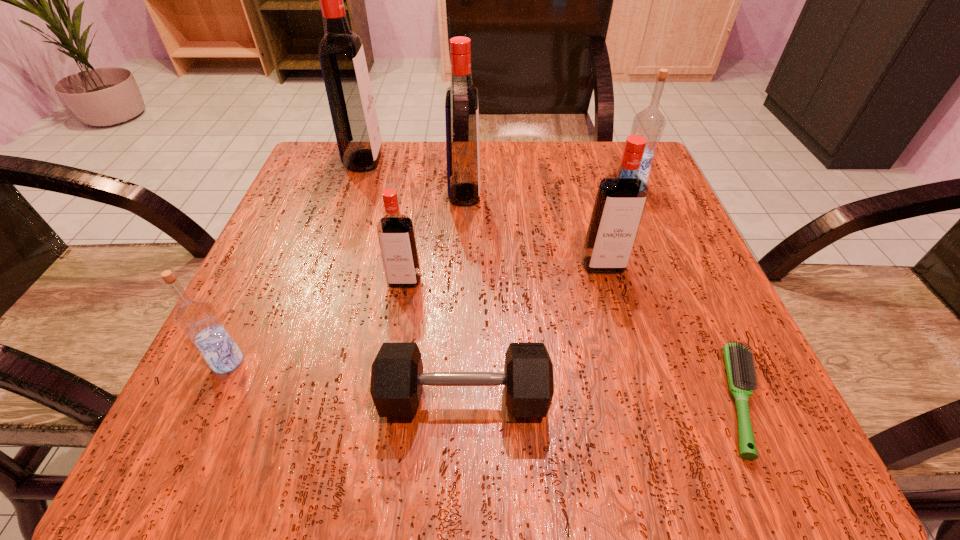
I want to click on the tallest object, so click(341, 54).

At what (x,y) coordinates should I click in order to perform the action: click on the leftmost red vodka. Please return your answer as a coordinate pair (x, y). This screenshot has height=540, width=960. Looking at the image, I should click on (341, 54).

Locate an element on the screen. The width and height of the screenshot is (960, 540). the second tallest object is located at coordinates (461, 102).

This screenshot has width=960, height=540. Find the location of `the second red vodka from right to left`. the second red vodka from right to left is located at coordinates (461, 102).

This screenshot has height=540, width=960. What are the coordinates of `the right blue vodka` in the screenshot? It's located at (650, 123).

Identify the location of the farther blue vodka. The width and height of the screenshot is (960, 540). (650, 123).

Locate an element on the screen. the second vodka from right to left is located at coordinates (621, 197).

Locate an element on the screen. This screenshot has width=960, height=540. the third biggest red vodka is located at coordinates tap(621, 197).

Identify the location of the fourth vodka from right to left. The height and width of the screenshot is (540, 960). (396, 235).

The height and width of the screenshot is (540, 960). Find the location of `the second red vodka from left to right`. the second red vodka from left to right is located at coordinates (396, 235).